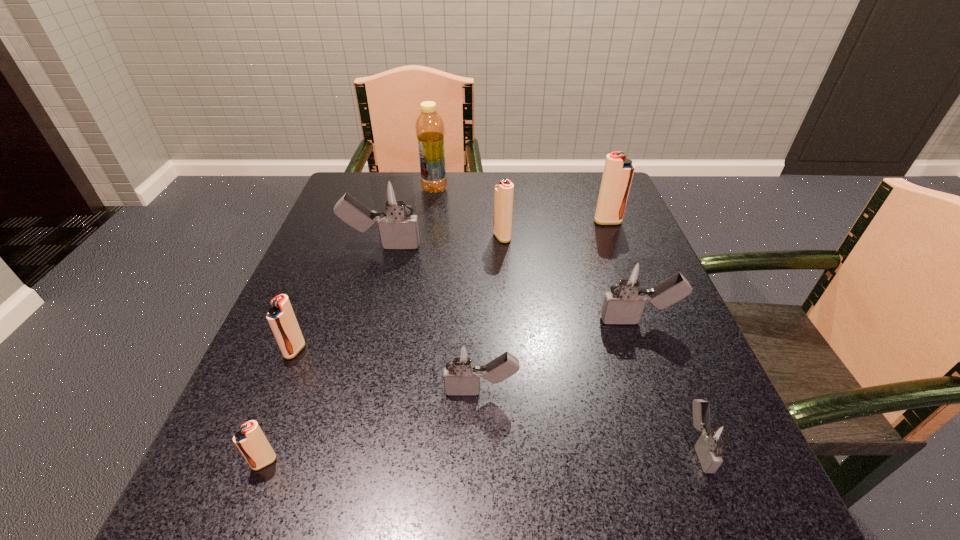
This screenshot has width=960, height=540. In the image, there is a desktop. Find the location of `vacant space at the far edge`. vacant space at the far edge is located at coordinates (514, 184).

The image size is (960, 540). What are the coordinates of `vacant space at the right edge of the desktop` in the screenshot? It's located at (623, 342).

Identify the location of vacant space at the near left corner of the desktop. (302, 539).

The width and height of the screenshot is (960, 540). I want to click on vacant region at the far right corner of the desktop, so click(587, 193).

At what (x,y) coordinates should I click in order to perform the action: click on vacant space that's between the third nearest igniter and the sixth farthest object. Please return your answer as a coordinate pair (x, y). This screenshot has width=960, height=540. Looking at the image, I should click on (388, 371).

Locate an element on the screen. This screenshot has height=540, width=960. free space between the smallest gray igniter and the bottle is located at coordinates (566, 317).

Identify the location of empty space between the third nearest object and the nearest gray igniter. Image resolution: width=960 pixels, height=540 pixels. (589, 418).

This screenshot has height=540, width=960. Find the location of `vacant space that is in between the smallest gray igniter and the third smallest red igniter`. vacant space that is in between the smallest gray igniter and the third smallest red igniter is located at coordinates (600, 341).

You are a GUI agent. You are given a task and a screenshot of the screen. Output one action in this format:
    pyautogui.click(x=<x>, y=<y>)
    Task: Click on the unoccupied area between the fourth farthest igniter and the third farthest gray igniter
    
    Given the screenshot: What is the action you would take?
    pyautogui.click(x=560, y=356)

Locate an element on the screen. vacant space that is in between the farthest object and the third nearest object is located at coordinates (458, 290).